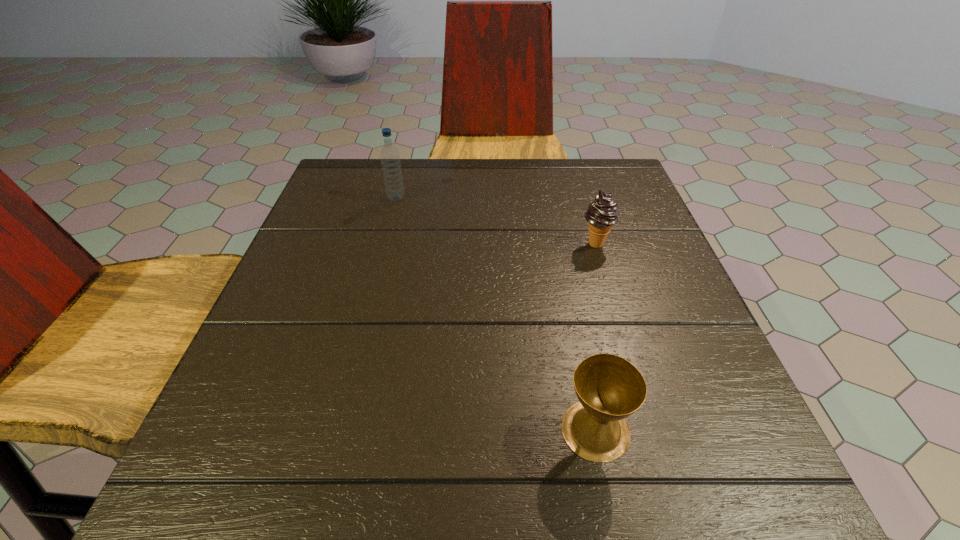
Where is `vacant space in between the second farthest object and the nearest object`? vacant space in between the second farthest object and the nearest object is located at coordinates (595, 336).

Where is `free area in between the farthest object and the icecream`? free area in between the farthest object and the icecream is located at coordinates (495, 221).

Identify the location of unoccupied area between the icecream and the leftmost object. Image resolution: width=960 pixels, height=540 pixels. (495, 221).

Where is `vacant area that lies between the icecream and the nearest object`? The height and width of the screenshot is (540, 960). vacant area that lies between the icecream and the nearest object is located at coordinates click(x=595, y=336).

Find the location of a particular element. This screenshot has height=540, width=960. vacant region between the icecream and the farthest object is located at coordinates (495, 221).

Where is `empty space between the second farthest object and the nearest object`? This screenshot has height=540, width=960. empty space between the second farthest object and the nearest object is located at coordinates (595, 336).

Where is `free space between the farthest object and the nearest object`? This screenshot has height=540, width=960. free space between the farthest object and the nearest object is located at coordinates (496, 314).

Find the location of a particular element. Image resolution: width=960 pixels, height=540 pixels. empty location between the nearest object and the farthest object is located at coordinates (496, 314).

Identify which object is located as the second nearest to the tallest object. Please provide its 2D coordinates. Your answer should be formatted as a tuple, i.e. [(x, y)], where the tuple contains the x and y coordinates of a point satisfying the conditions above.

[(609, 388)]

Where is `the closest object to the leftmost object`? The height and width of the screenshot is (540, 960). the closest object to the leftmost object is located at coordinates (601, 215).